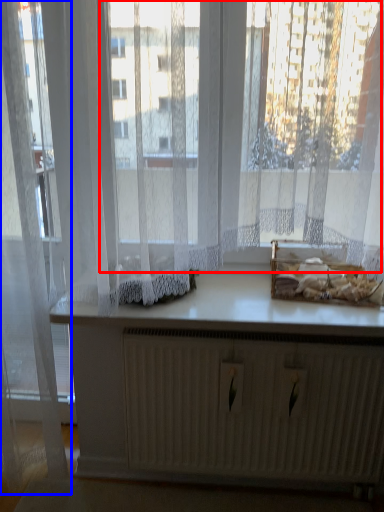
Question: Which object appears farthest to the camera in this image, bay window (highlighted by a red box) or curtain (highlighted by a blue box)?

Choices:
 (A) bay window
 (B) curtain

Answer: (B)